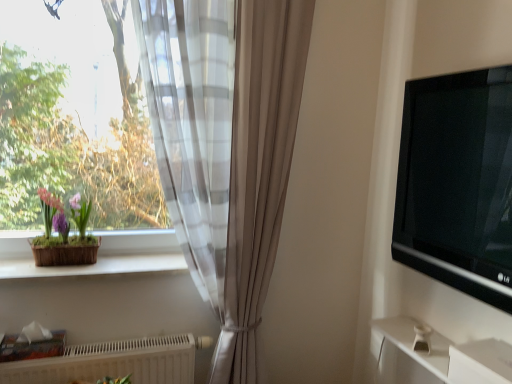
At what (x,y) coordinates should I click in order to perform the action: click on free region under black glossy tv at right (from a real-world perspective). Please return your answer as a coordinate pair (x, y). The width and height of the screenshot is (512, 384). Looking at the image, I should click on (444, 256).